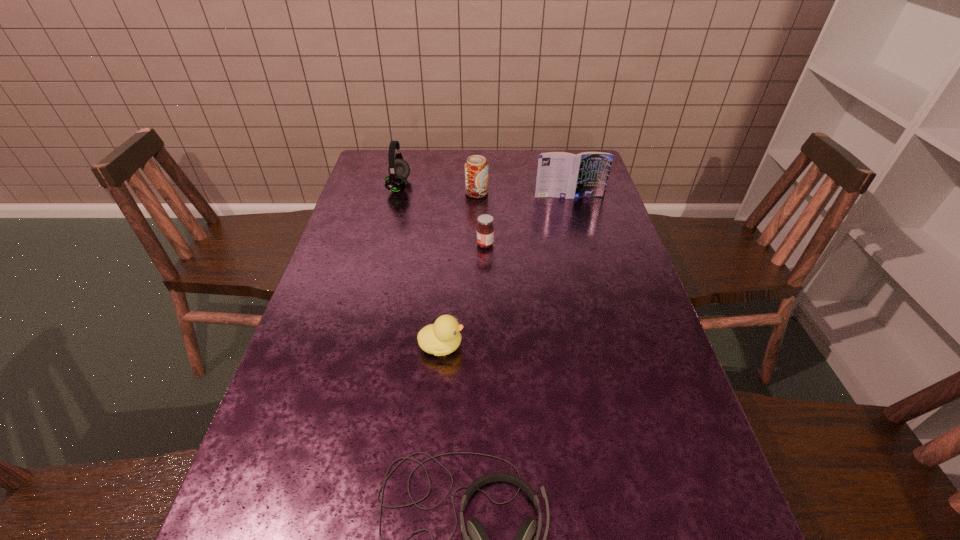
Image resolution: width=960 pixels, height=540 pixels. In order to click on the taller headset in this screenshot , I will do `click(399, 170)`.

Identify the location of the farther headset. The image size is (960, 540). (399, 170).

Where is `book`? The image size is (960, 540). book is located at coordinates (565, 175).

Image resolution: width=960 pixels, height=540 pixels. I want to click on the fourth shortest object, so click(476, 167).

This screenshot has height=540, width=960. Find the location of `the fourth farthest object`. the fourth farthest object is located at coordinates (485, 231).

Identify the location of duckling. The height and width of the screenshot is (540, 960). (443, 337).

The image size is (960, 540). What are the coordinates of `vacant area situated on the ear cups of the farther headset` in the screenshot? It's located at (442, 186).

The height and width of the screenshot is (540, 960). Find the location of `vacant space located on the front cover of the book`. vacant space located on the front cover of the book is located at coordinates (591, 279).

This screenshot has height=540, width=960. In order to click on free space located on the front of the third tallest object in this screenshot , I will do `click(476, 263)`.

Where is `vacant region located 0.350m on the label side of the jam`? The image size is (960, 540). vacant region located 0.350m on the label side of the jam is located at coordinates (357, 245).